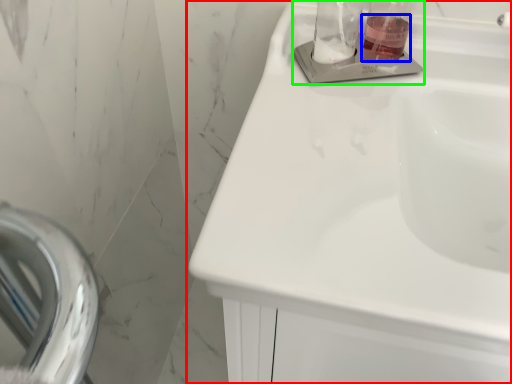
Question: Considering the real-world distances, which object is closest to sink (highlighted by a red box)? liquid (highlighted by a blue box) or sink (highlighted by a green box).

Choices:
 (A) liquid
 (B) sink

Answer: (B)